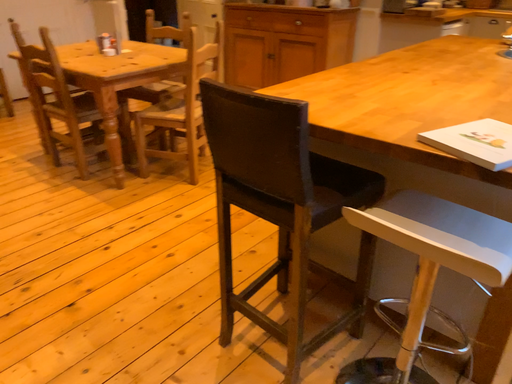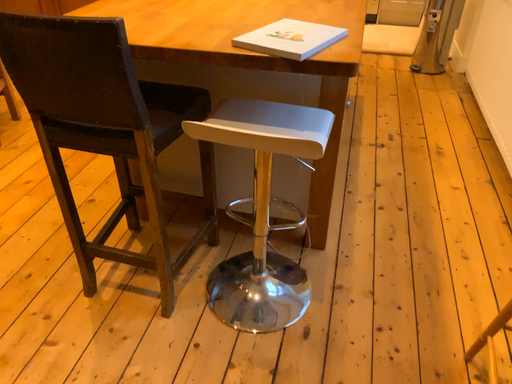
Question: Which way did the camera rotate in the video?

Choices:
 (A) rotated right
 (B) rotated left

Answer: (A)